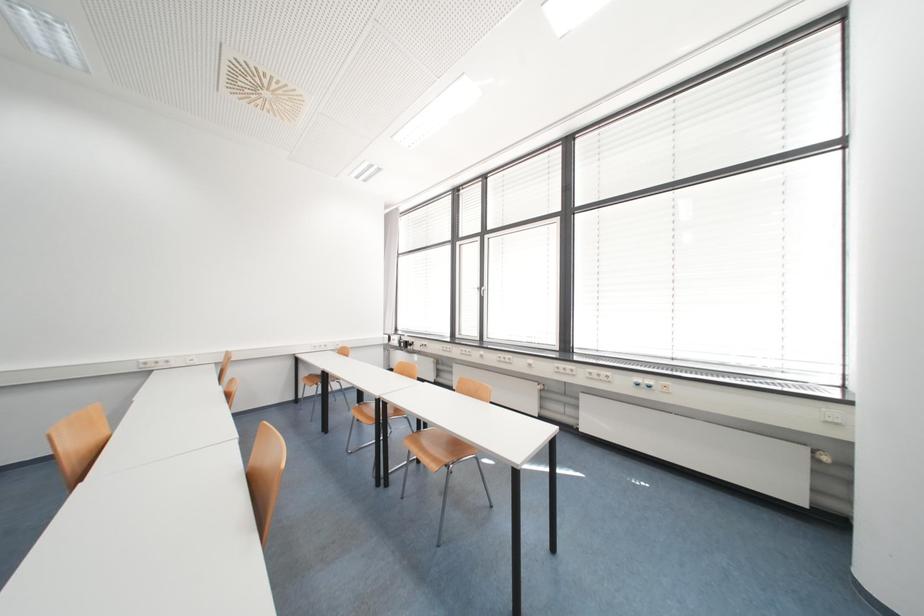
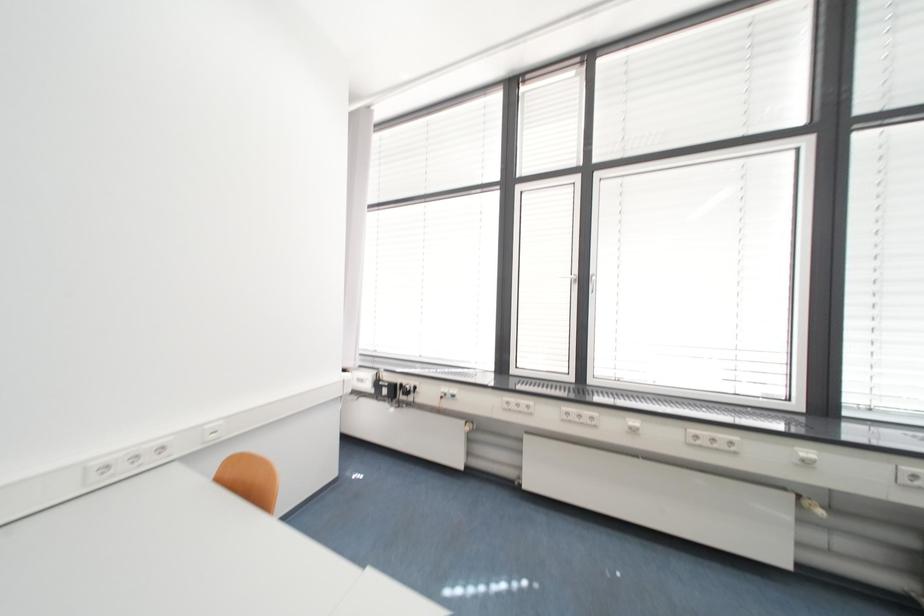
In a continuous first-person perspective shot, in which direction is the camera moving?

The cameraman walked toward left, forward.